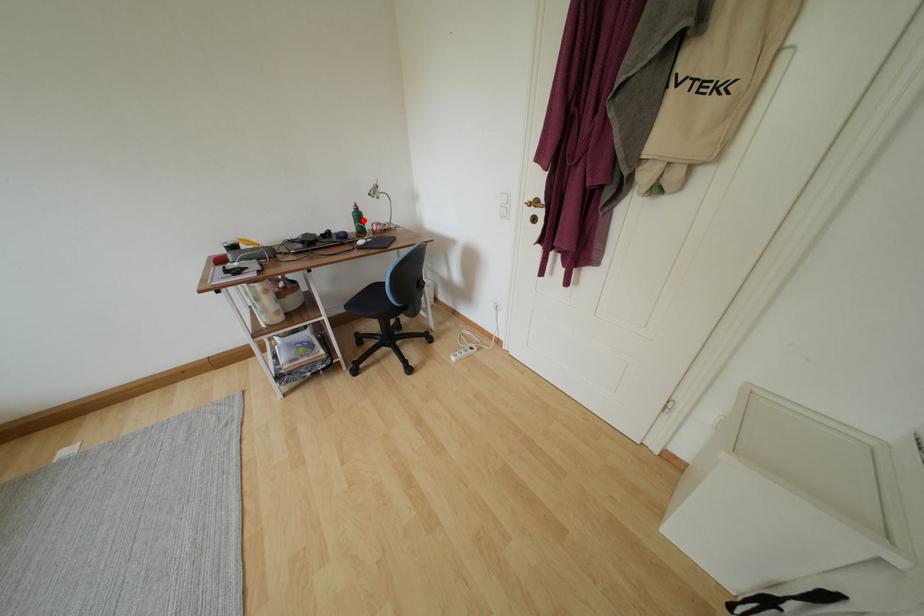
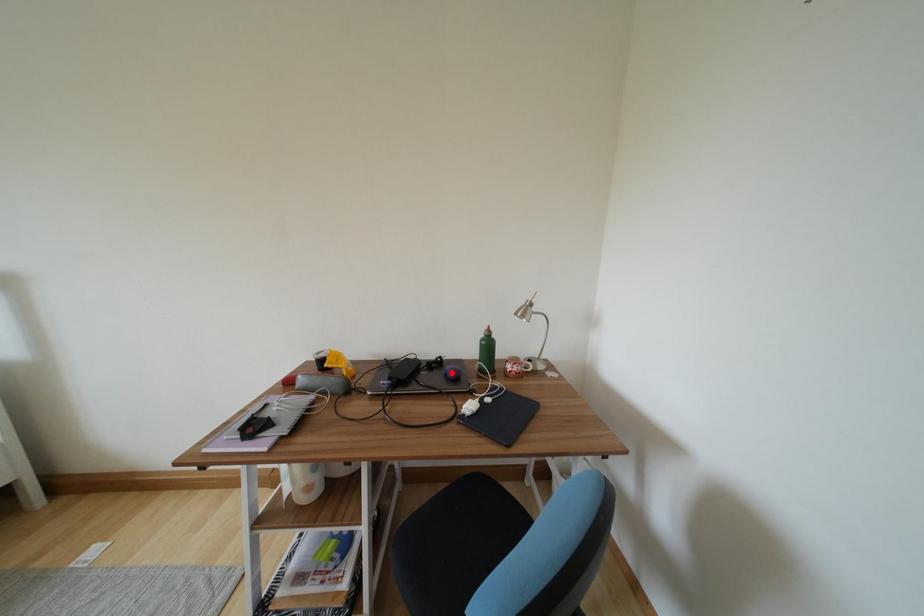
I am providing you with two images of the same scene from different viewpoints. A red point is marked on the first image and another point is marked on the second image. Do the highlighted points in image1 and image2 indicate the same real-world spot?

No